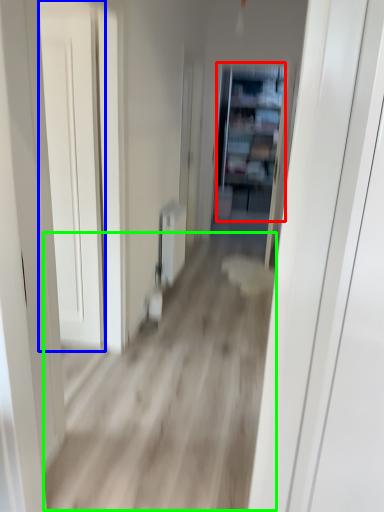
Question: Which object is the closest to the bookshelf (highlighted by a red box)? Choose among these: door (highlighted by a blue box) or corridor (highlighted by a green box).

Choices:
 (A) door
 (B) corridor

Answer: (B)